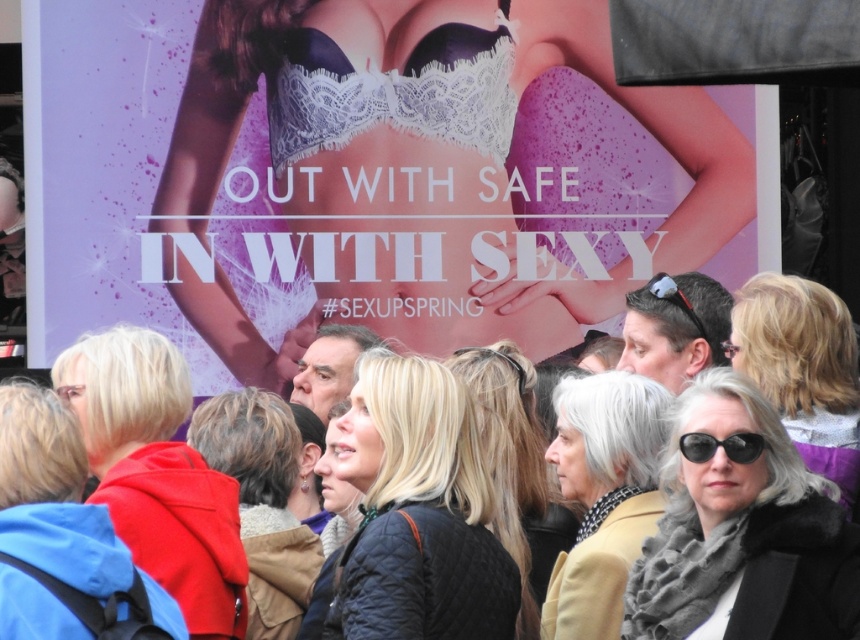
Question: Based on their relative distances, which object is nearer to the matte red hoodie at center?

Choices:
 (A) blonde hair at center
 (B) white rubber goggles at center
 (C) quilted black jacket at center
 (D) matte black sunglasses at center

Answer: (C)

Question: Which object is the farthest from the gray wool scarf at center?

Choices:
 (A) matte black sunglasses at center
 (B) white rubber goggles at center
 (C) black quilted jacket at center

Answer: (B)

Question: Which is farther from the quilted black jacket at center?

Choices:
 (A) dark brown textured coat at center
 (B) matte red hoodie at center
 (C) white rubber goggles at center

Answer: (C)

Question: Can you confirm if matte red hoodie at center is bigger than gray wool scarf at center?

Choices:
 (A) no
 (B) yes

Answer: (B)

Question: Can you confirm if matte red hoodie at center is wider than blonde hair at center?

Choices:
 (A) yes
 (B) no

Answer: (A)

Question: Is quilted black jacket at center wider than matte red hoodie at center?

Choices:
 (A) no
 (B) yes

Answer: (A)